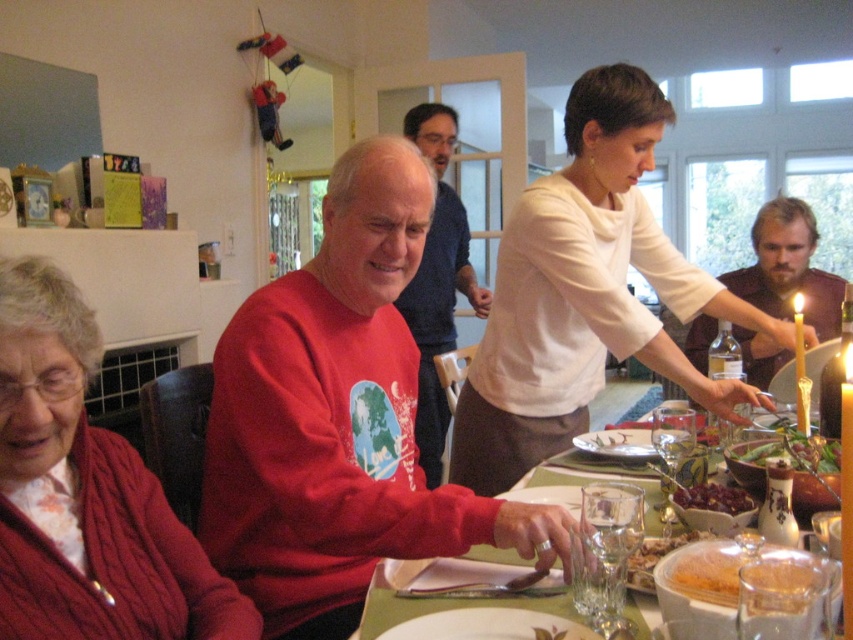
Question: Does brown leather jacket at upper right have a greater width compared to green leafy salad at center?

Choices:
 (A) yes
 (B) no

Answer: (A)

Question: Is cabled knit sweater at left positioned before golden crumbly bread at lower right?

Choices:
 (A) no
 (B) yes

Answer: (A)

Question: Is golden crumbly bread at lower right below shiny red grapes at table center?

Choices:
 (A) no
 (B) yes

Answer: (B)

Question: Which of the following is the farthest from the observer?

Choices:
 (A) (467, 282)
 (B) (734, 554)
 (C) (795, 294)

Answer: (A)

Question: Which point is closer to the camera?

Choices:
 (A) (422, 625)
 (B) (648, 497)
 (C) (686, 536)
 (D) (68, 486)

Answer: (A)

Question: Which of these objects is positioned farthest from the brown leather jacket at upper right?

Choices:
 (A) cabled knit sweater at left
 (B) white ceramic plate at lower center

Answer: (A)